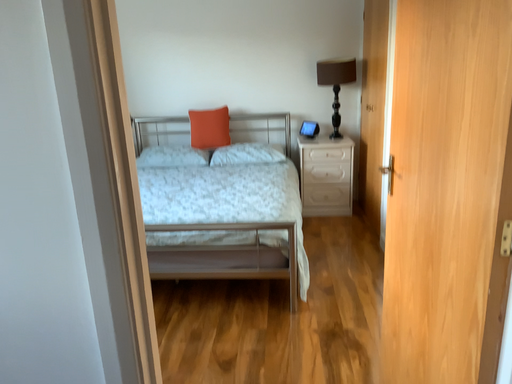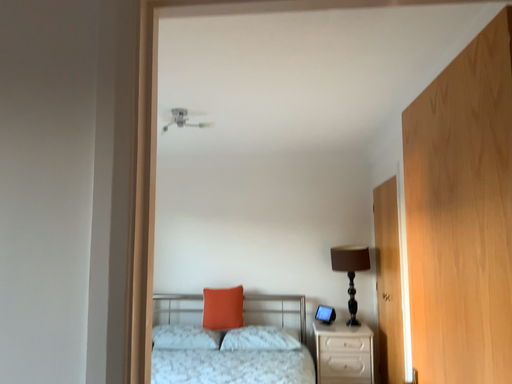
Question: Which way did the camera rotate in the video?

Choices:
 (A) rotated downward
 (B) rotated upward

Answer: (B)